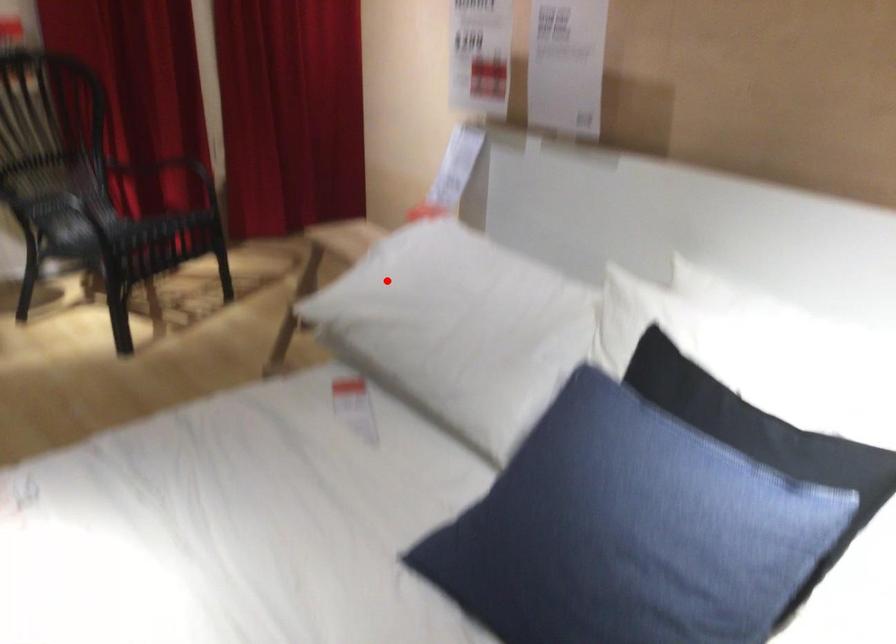
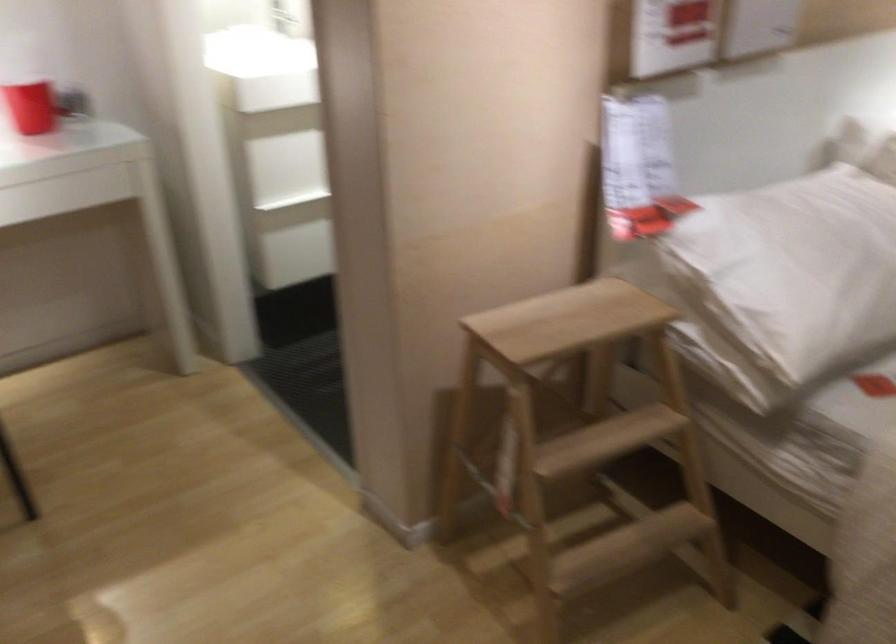
Question: I am providing you with two images of the same scene from different viewpoints. In image1, a red point is highlighted. Considering the same 3D point in image2, which of the following is correct?

Choices:
 (A) It is closer
 (B) It is farther

Answer: (A)